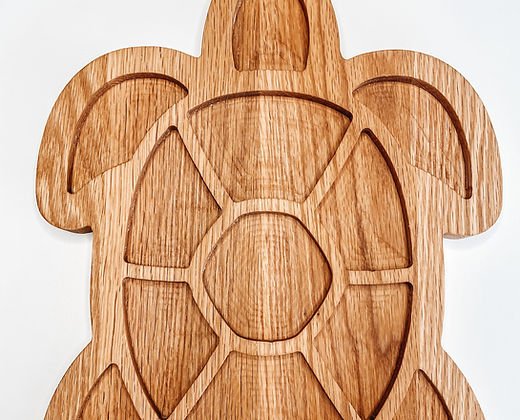
The height and width of the screenshot is (420, 520). In order to click on brown grains in wood in this screenshot , I will do `click(384, 362)`, `click(283, 44)`, `click(255, 65)`, `click(362, 236)`, `click(200, 332)`.